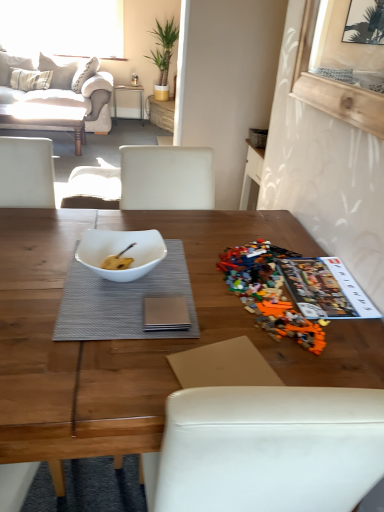
Locate an element on the screen. Image resolution: width=384 pixels, height=512 pixels. vacant space in front of white paper magazine at right is located at coordinates (344, 332).